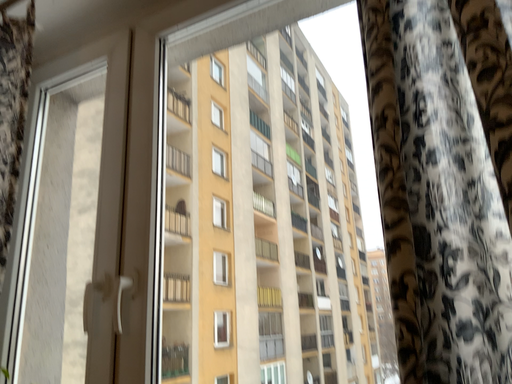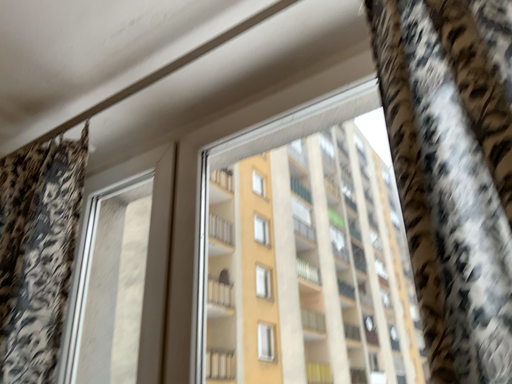
Question: Which way did the camera rotate in the video?

Choices:
 (A) rotated upward
 (B) rotated downward

Answer: (A)